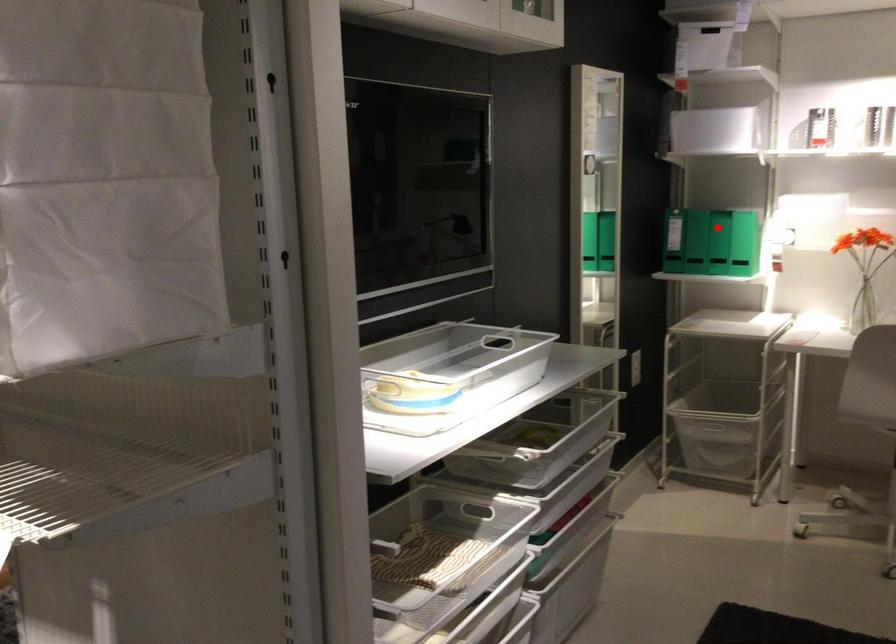
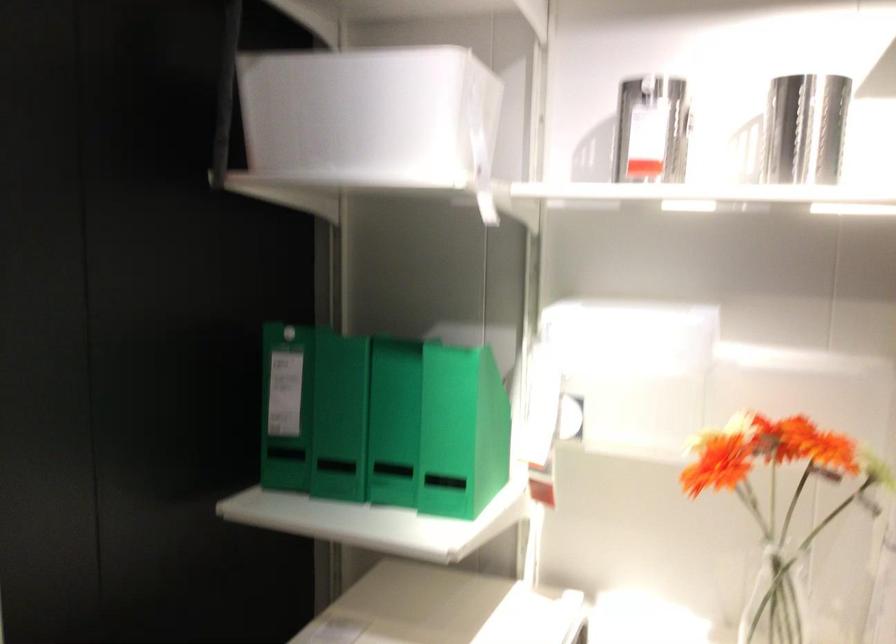
Question: A red point is marked in image1. In image2, is the corresponding 3D point closer to the camera or farther? Reply with the corresponding letter.

Choices:
 (A) The corresponding 3D point is closer.
 (B) The corresponding 3D point is farther.

Answer: (A)